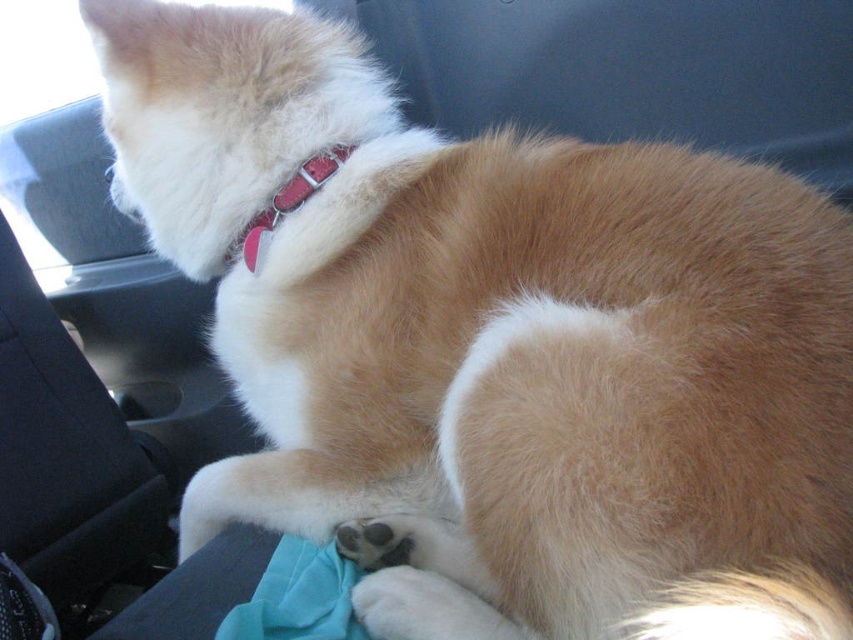
You are a dog owner who wants to ensure your dog is safe in the car. You notice the dog has a red collar at upper center. Where exactly is the red collar at upper center located in relation to the point marked at point coordinates (x=630, y=70)?

The red collar at upper center is located exactly at point coordinates (x=630, y=70).

You are a dog owner who wants to ensure your dog is comfortable in the car. You notice the matte red collar at upper center and the teal fabric at lower center. Which object is closer to the front of the car?

The matte red collar at upper center is closer to the front of the car because it is in front of the teal fabric at lower center.